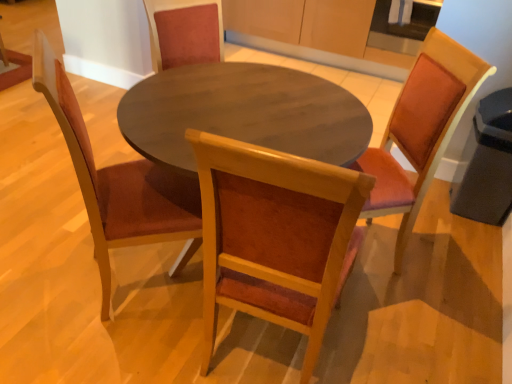
Locate an element on the screen. The image size is (512, 384). vacant space situated on the left part of wooden chair at left, which is the 1th chair in left-to-right order is located at coordinates (47, 258).